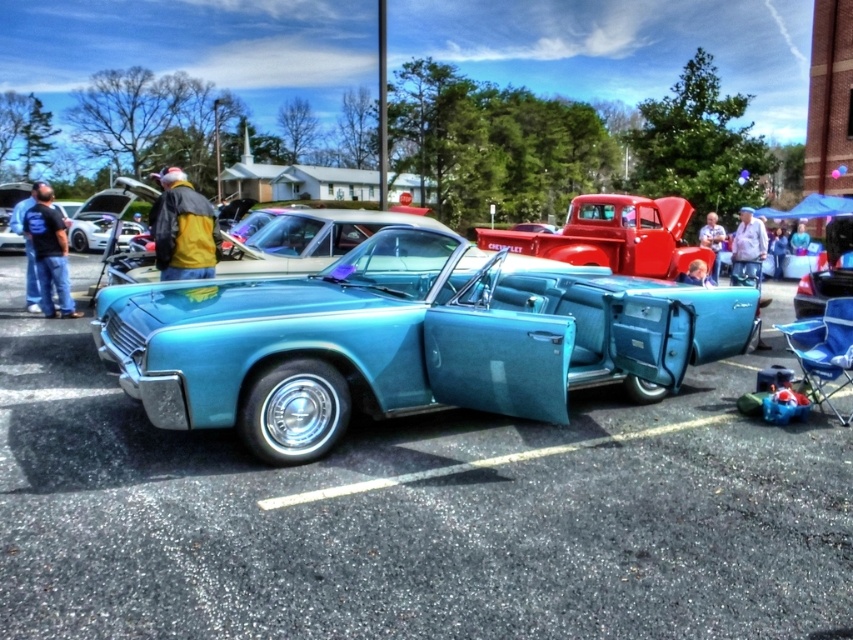
Is teal leather convertible at center wider than shiny red truck at center?

Incorrect, teal leather convertible at center's width does not surpass shiny red truck at center's.

Is teal leather convertible at center to the left of shiny red truck at center from the viewer's perspective?

Indeed, teal leather convertible at center is positioned on the left side of shiny red truck at center.

Locate an element on the screen. The width and height of the screenshot is (853, 640). teal leather convertible at center is located at coordinates (403, 340).

Can you confirm if teal metallic car at center is smaller than teal leather convertible at center?

Correct, teal metallic car at center occupies less space than teal leather convertible at center.

Is teal metallic car at center positioned in front of teal leather convertible at center?

No, it is behind teal leather convertible at center.

Is point (62, 605) in front of point (194, 401)?

Yes, point (62, 605) is in front of point (194, 401).

Locate an element on the screen. Image resolution: width=853 pixels, height=640 pixels. teal metallic car at center is located at coordinates (416, 516).

Which is in front, point (78, 560) or point (705, 236)?

Point (78, 560) is in front.

Is point (83, 515) positioned after point (703, 244)?

No, it is not.

Does point (149, 499) lie in front of point (715, 253)?

Yes, point (149, 499) is in front of point (715, 253).

At what (x,y) coordinates should I click in order to perform the action: click on teal metallic car at center. Please return your answer as a coordinate pair (x, y). This screenshot has height=640, width=853. Looking at the image, I should click on (416, 516).